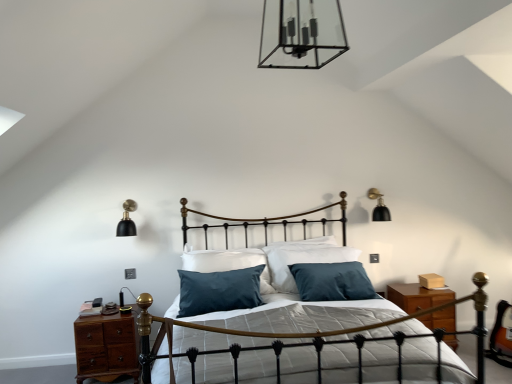
Find the location of a particular element. The image size is (512, 384). empty space that is ontop of brown wood nightstand at left (from a real-world perspective) is located at coordinates (97, 308).